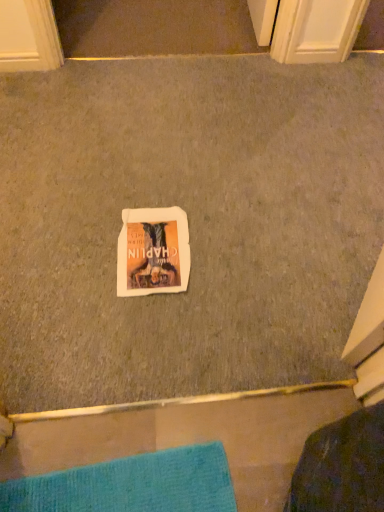
I want to click on empty space that is ontop of white paper towel at center, so click(x=194, y=174).